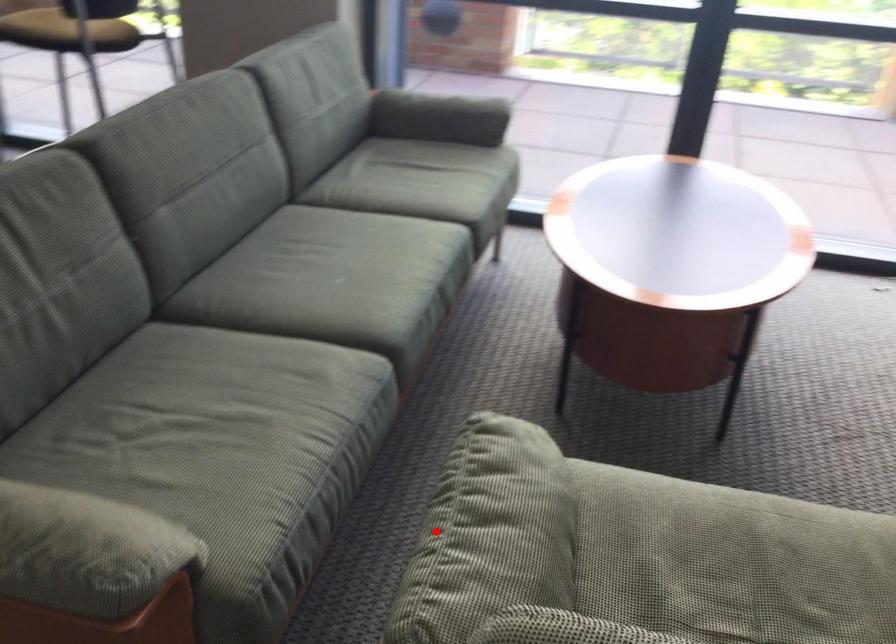
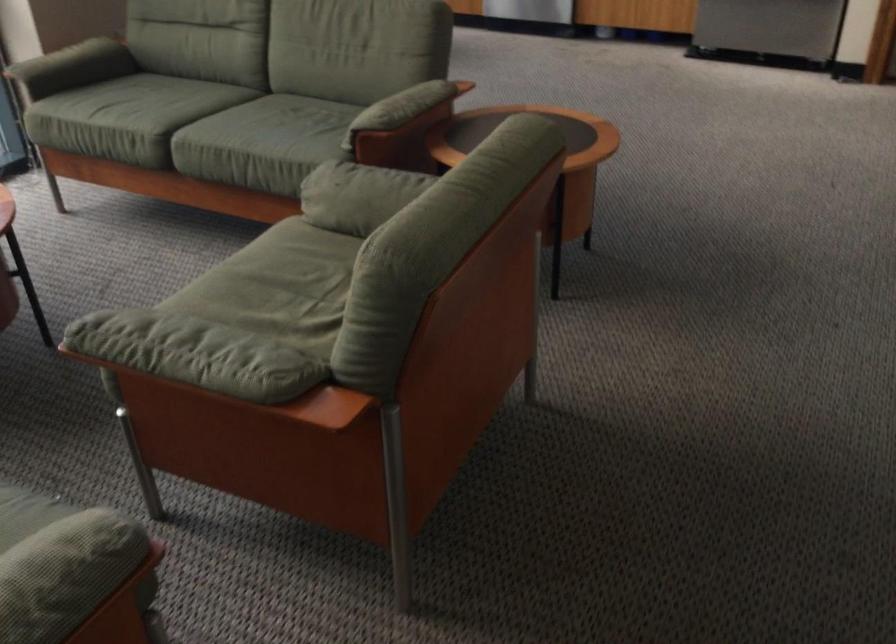
Question: I am providing you with two images of the same scene from different viewpoints. Given a red point in image1, look at the same physical point in image2. Is it:

Choices:
 (A) Closer to the viewpoint
 (B) Farther from the viewpoint

Answer: (B)